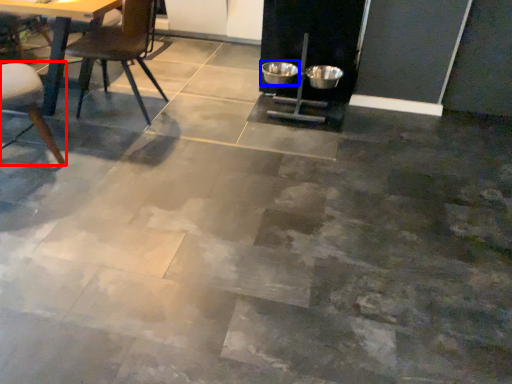
Question: Which object is closer to the camera taking this photo, chair (highlighted by a red box) or bowl (highlighted by a blue box)?

Choices:
 (A) chair
 (B) bowl

Answer: (A)